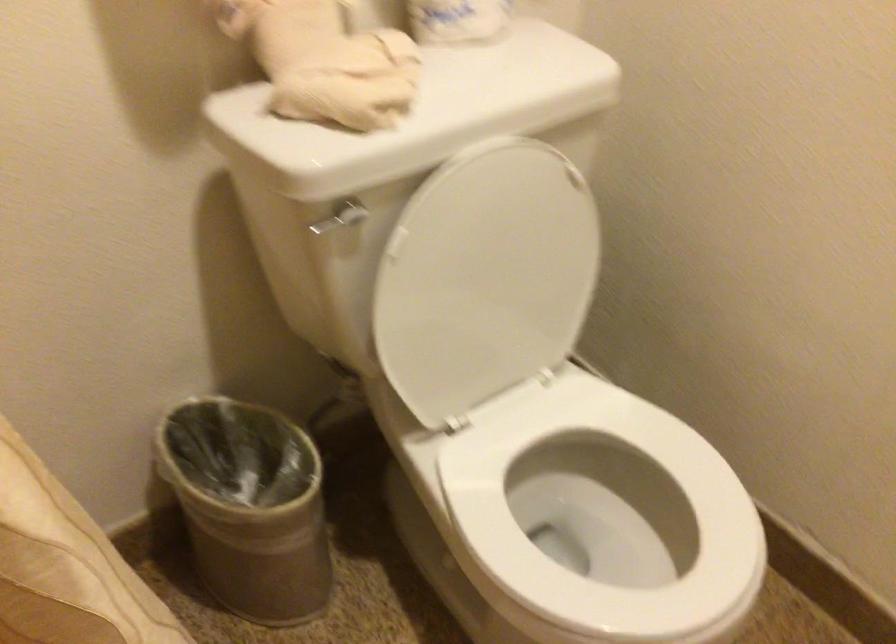
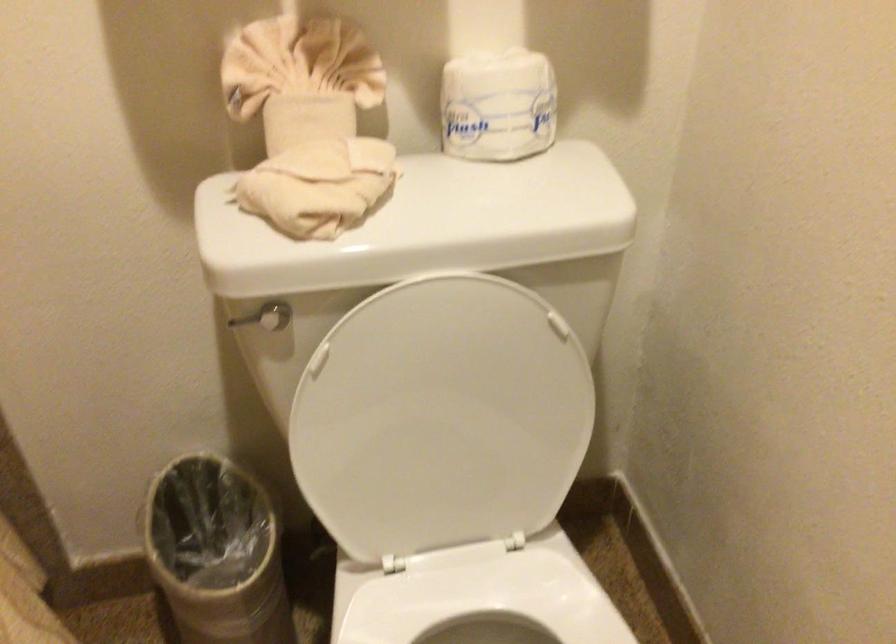
Question: The images are taken continuously from a first-person perspective. In which direction is your viewpoint rotating?

Choices:
 (A) Left
 (B) Right
 (C) Up
 (D) Down

Answer: (A)